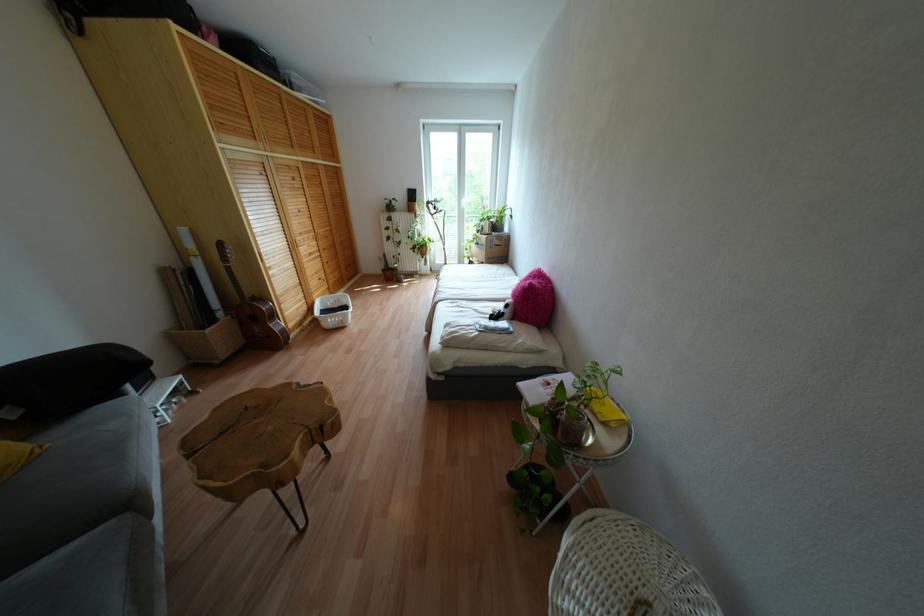
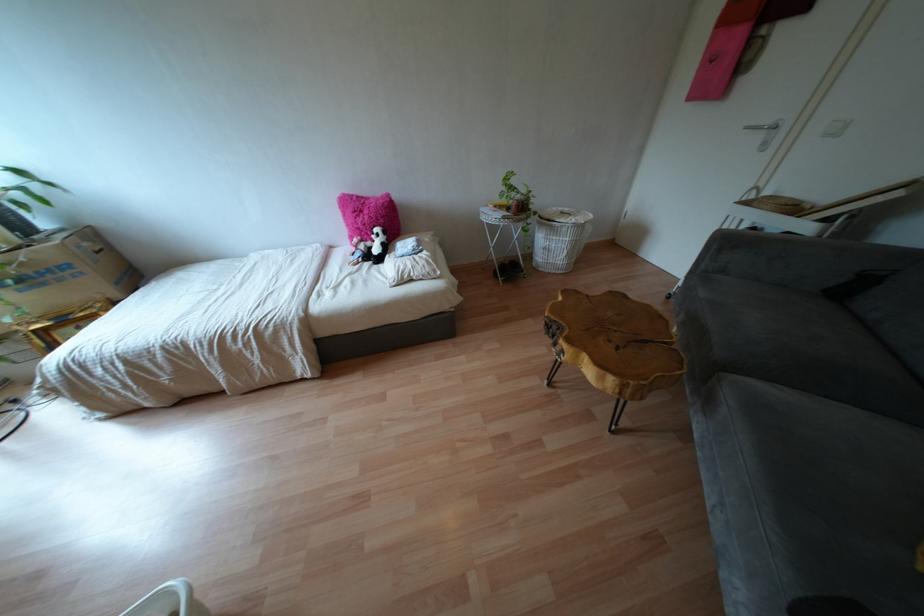
Find the pixel in the second image that matches (x=475, y=310) in the first image.

(349, 274)